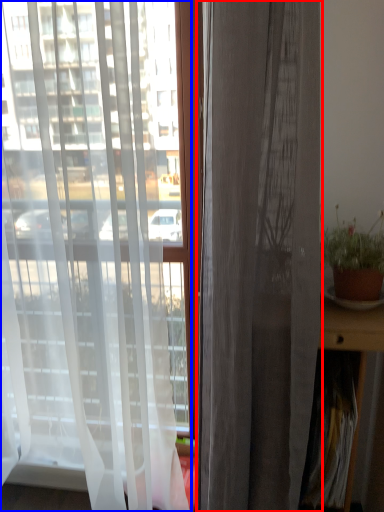
Question: Which of the following is the closest to the observer, curtain (highlighted by a red box) or curtain (highlighted by a blue box)?

Choices:
 (A) curtain
 (B) curtain

Answer: (A)